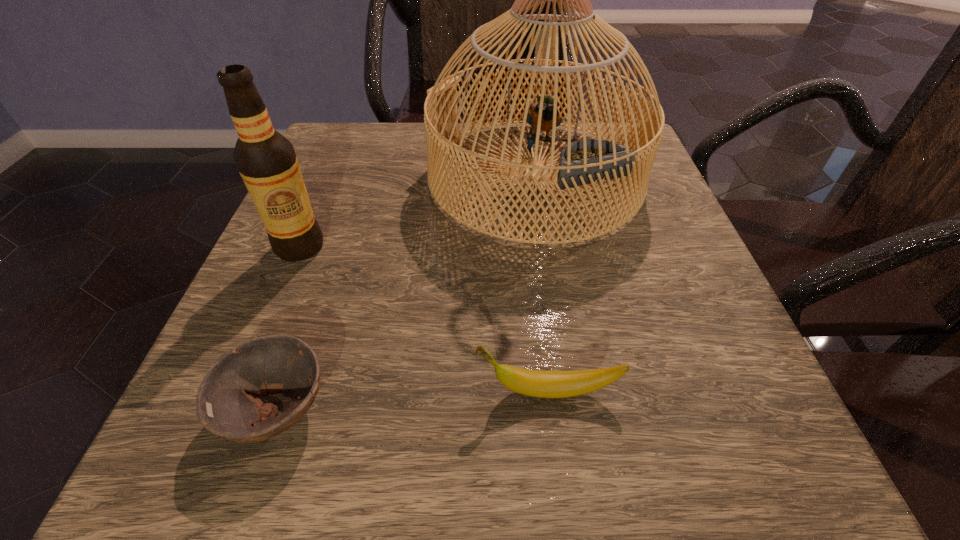
I want to click on object positioned at the far edge, so click(587, 161).

Find the location of a particular element. The height and width of the screenshot is (540, 960). object located at the near edge is located at coordinates (275, 364).

This screenshot has height=540, width=960. Find the location of `alcohol situated at the left edge`. alcohol situated at the left edge is located at coordinates (266, 160).

Locate an element on the screen. Image resolution: width=960 pixels, height=540 pixels. bowl located in the left edge section of the desktop is located at coordinates (275, 364).

This screenshot has width=960, height=540. I want to click on object situated at the right edge, so click(x=587, y=161).

The width and height of the screenshot is (960, 540). I want to click on object located at the near left corner, so click(x=275, y=364).

This screenshot has width=960, height=540. In order to click on object positioned at the far right corner in this screenshot , I will do `click(587, 161)`.

Locate an element on the screen. free region at the far edge of the desktop is located at coordinates [x=479, y=143].

Locate an element on the screen. vacant space at the near edge is located at coordinates (353, 454).

The image size is (960, 540). In the image, there is a desktop. Find the location of `blank space at the left edge`. blank space at the left edge is located at coordinates (260, 294).